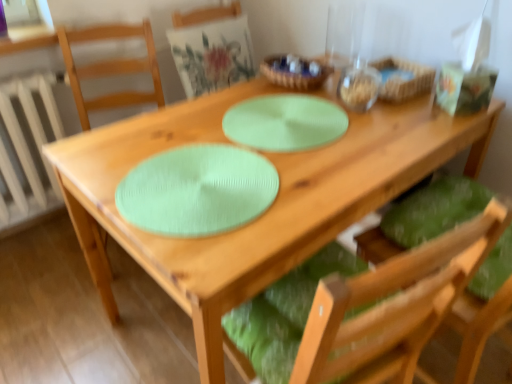
Locate an element on the screen. The width and height of the screenshot is (512, 384). free space in front of green textured placemat at center is located at coordinates (274, 181).